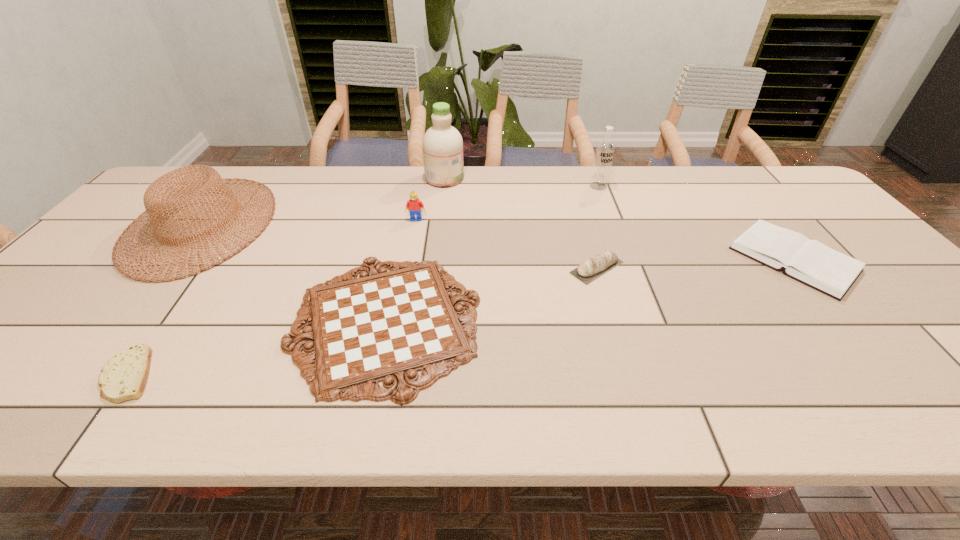
Locate an element on the screen. The width and height of the screenshot is (960, 540). free space at the far right corner is located at coordinates tap(796, 183).

Locate an element on the screen. The height and width of the screenshot is (540, 960). free point between the nearer pita bread and the sunhat is located at coordinates (166, 299).

Identify the location of vacant region between the chessboard and the tallest object. This screenshot has height=540, width=960. 415,250.

Locate an element on the screen. free spot between the vodka and the fourth shortest object is located at coordinates (597, 227).

Locate an element on the screen. This screenshot has width=960, height=540. vacant region between the vodka and the chessboard is located at coordinates (492, 254).

This screenshot has height=540, width=960. In order to click on free space between the fourth tallest object and the vodka in this screenshot , I will do `click(507, 202)`.

Find the location of a particular element. The image size is (960, 540). free space between the chessboard and the tallest object is located at coordinates (415, 250).

The width and height of the screenshot is (960, 540). I want to click on blank region between the cleansing agent and the nearer pita bread, so click(x=287, y=276).

Where is `free spot between the taller pita bread and the sunhat`? The width and height of the screenshot is (960, 540). free spot between the taller pita bread and the sunhat is located at coordinates (399, 246).

This screenshot has width=960, height=540. In order to click on empty space between the sixth tallest object and the fourth shortest object in this screenshot , I will do tap(695, 264).